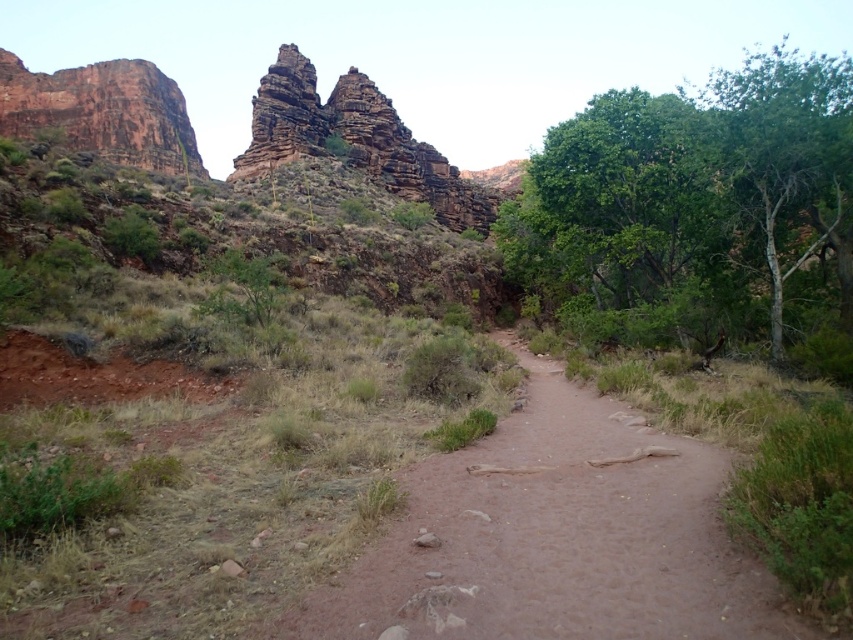
Who is positioned more to the left, rustic stone formation at upper center or reddish-brown rock formation at upper left?

Positioned to the left is reddish-brown rock formation at upper left.

Between point (370, 86) and point (107, 132), which one is positioned in front?

Point (370, 86)

At what (x,y) coordinates should I click in order to perform the action: click on rustic stone formation at upper center. Please return your answer as a coordinate pair (x, y). Looking at the image, I should click on (354, 140).

Is green leafy tree at right further to the viewer compared to reddish-brown rock formation at upper left?

No, it is not.

Is green leafy tree at right thinner than reddish-brown rock formation at upper left?

No, green leafy tree at right is not thinner than reddish-brown rock formation at upper left.

Is point (566, 131) more distant than point (138, 68)?

No, (566, 131) is in front of (138, 68).

Identify the location of green leafy tree at right. (693, 192).

Does brown sandy dirt track at center have a greater height compared to green leafy tree at right?

No, brown sandy dirt track at center is not taller than green leafy tree at right.

Locate an element on the screen. Image resolution: width=853 pixels, height=640 pixels. brown sandy dirt track at center is located at coordinates (556, 538).